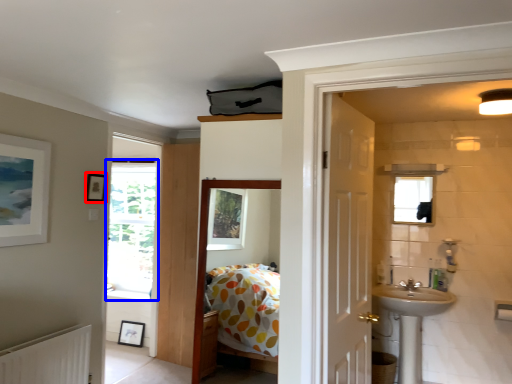
Question: Which object appears farthest to the camera in this image, picture frame (highlighted by a red box) or window (highlighted by a blue box)?

Choices:
 (A) picture frame
 (B) window

Answer: (B)